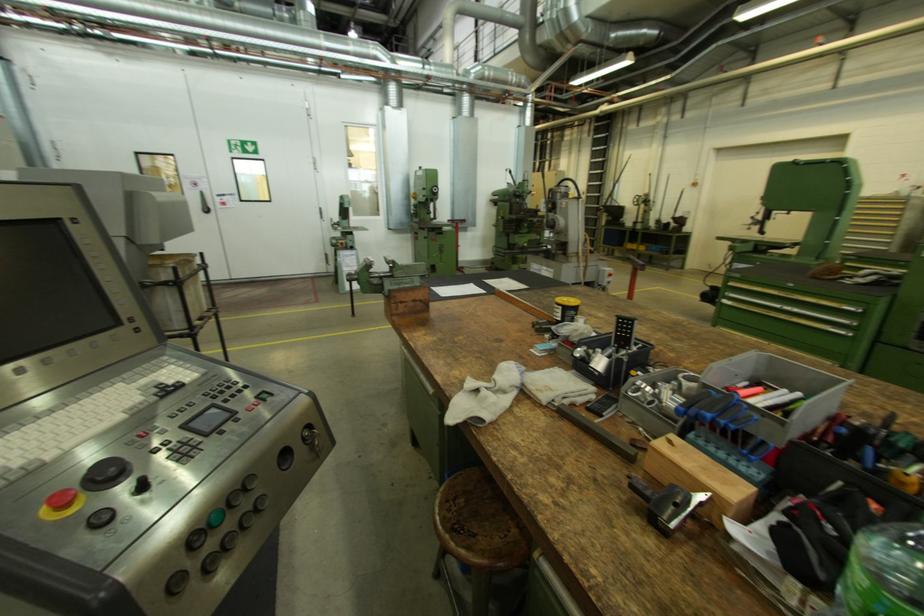
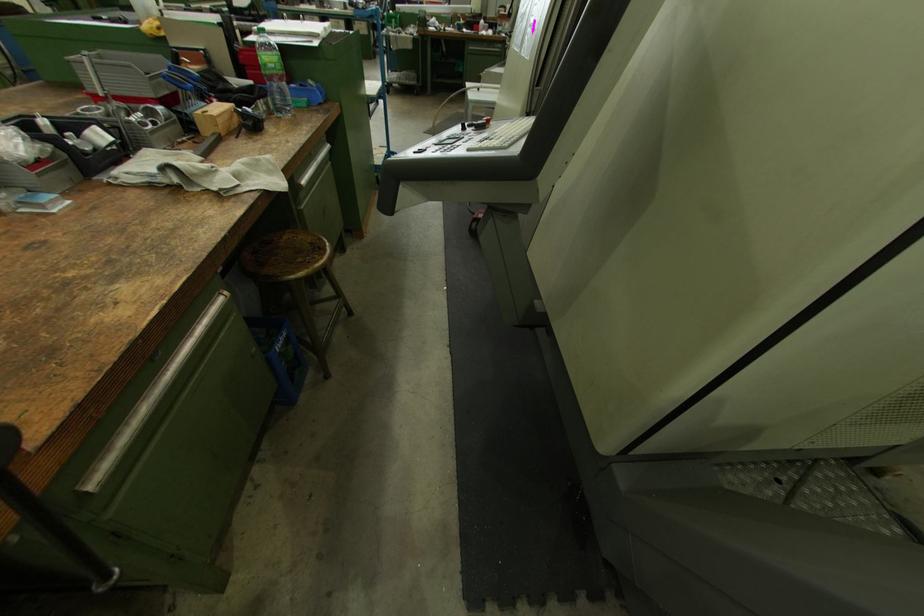
The point at (479, 537) is marked in the first image. Where is the corresponding point in the second image?

(317, 244)